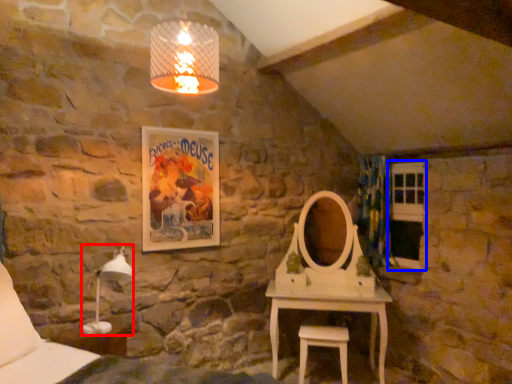
Question: Which point is closer to the camera, table lamp (highlighted by a red box) or window (highlighted by a blue box)?

Choices:
 (A) table lamp
 (B) window

Answer: (A)